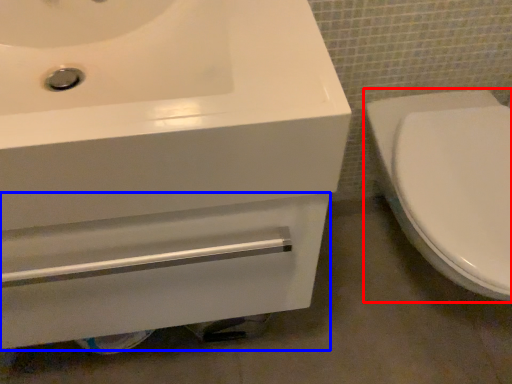
Question: Which object appears farthest to the camera in this image, toilet (highlighted by a red box) or drawer (highlighted by a blue box)?

Choices:
 (A) toilet
 (B) drawer

Answer: (B)